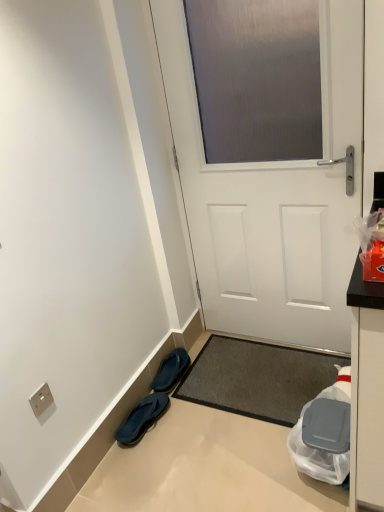
Question: Is blue rubber flip-flops at lower left, the 1th footwear viewed from the front, taller or shorter than dark gray textured mat at center?

Choices:
 (A) short
 (B) tall

Answer: (B)

Question: In terms of size, does blue rubber flip-flops at lower left, the 1th footwear viewed from the front, appear bigger or smaller than dark gray textured mat at center?

Choices:
 (A) big
 (B) small

Answer: (B)

Question: Estimate the real-world distances between objects in this image. Which object is closer to the dark gray textured mat at center?

Choices:
 (A) blue rubber flip-flops at lower left, which is the 2th footwear in back-to-front order
 (B) white matte door at center
 (C) blue rubber flip-flops at lower left, the second footwear in the front-to-back sequence
 (D) silver metallic electric outlet at lower left

Answer: (C)

Question: Considering the real-world distances, which object is closest to the dark gray textured mat at center?

Choices:
 (A) white matte door at center
 (B) blue rubber flip-flops at lower left, which is the 2th footwear in back-to-front order
 (C) blue rubber flip-flops at lower left, arranged as the first footwear when viewed from the back
 (D) silver metallic electric outlet at lower left

Answer: (C)